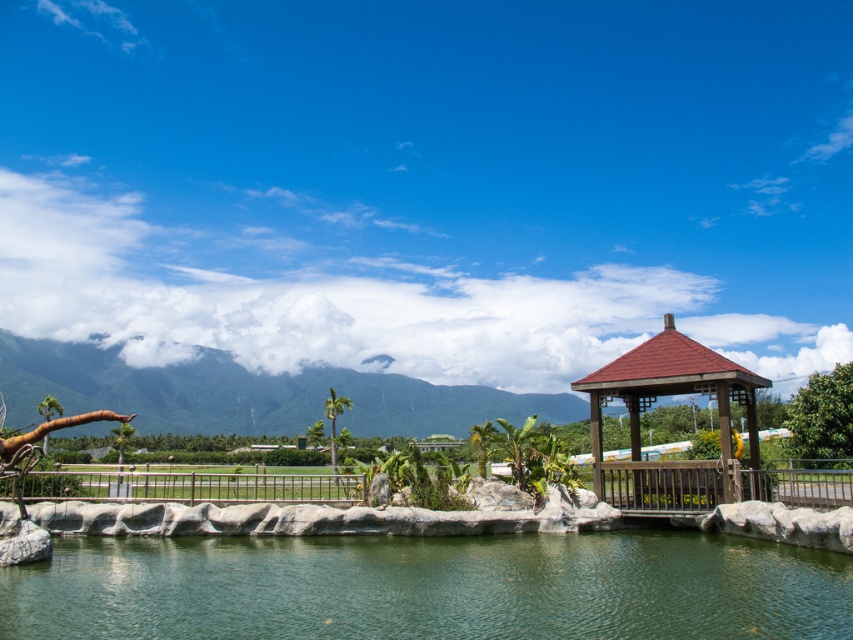
Does green smooth water at center have a lesser width compared to brown wooden gazebo at center-right?

No.

Can you confirm if green smooth water at center is bigger than brown wooden gazebo at center-right?

Actually, green smooth water at center might be smaller than brown wooden gazebo at center-right.

Who is more distant from viewer, [548,563] or [635,413]?

Positioned behind is point [635,413].

You are a GUI agent. You are given a task and a screenshot of the screen. Output one action in this format:
    pyautogui.click(x=<x>, y=<y>)
    Task: Click on the green smooth water at center
    The image size is (853, 640).
    Given the screenshot: What is the action you would take?
    pyautogui.click(x=428, y=588)